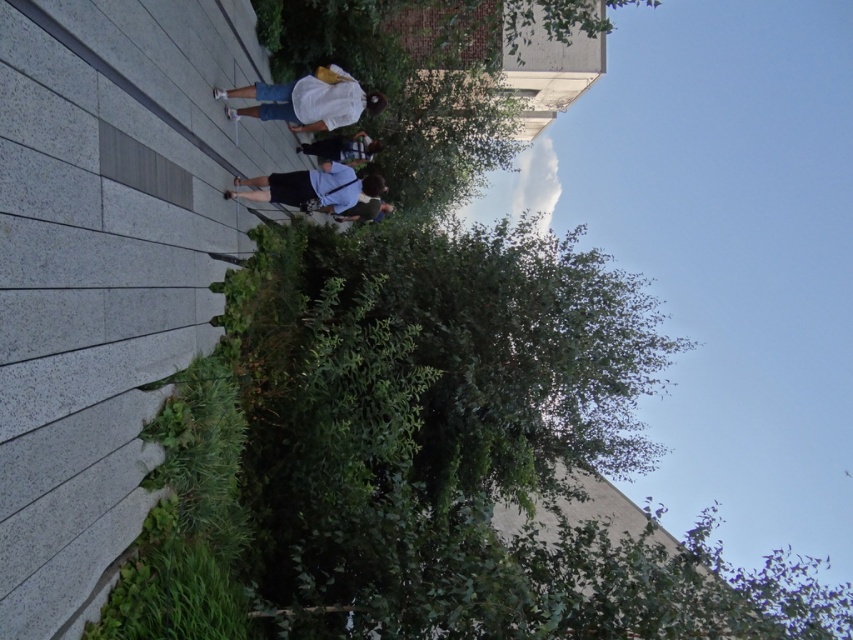
I want to click on white cotton shirt at center, so click(x=306, y=100).

Where is `white cotton shirt at center`? Image resolution: width=853 pixels, height=640 pixels. white cotton shirt at center is located at coordinates (306, 100).

The width and height of the screenshot is (853, 640). Find the location of `white cotton shirt at center`. white cotton shirt at center is located at coordinates (306, 100).

Who is higher up, white cotton shirt at center or light blue shirt at center?

white cotton shirt at center is above.

Does white cotton shirt at center appear on the left side of light blue shirt at center?

Correct, you'll find white cotton shirt at center to the left of light blue shirt at center.

I want to click on white cotton shirt at center, so click(306, 100).

Does white cotton shirt at center appear over blue denim shorts at center?

Correct, white cotton shirt at center is located above blue denim shorts at center.

Is white cotton shirt at center to the left of blue denim shorts at center from the viewer's perspective?

Yes, white cotton shirt at center is to the left of blue denim shorts at center.

I want to click on white cotton shirt at center, so click(306, 100).

Image resolution: width=853 pixels, height=640 pixels. I want to click on white cotton shirt at center, so click(306, 100).